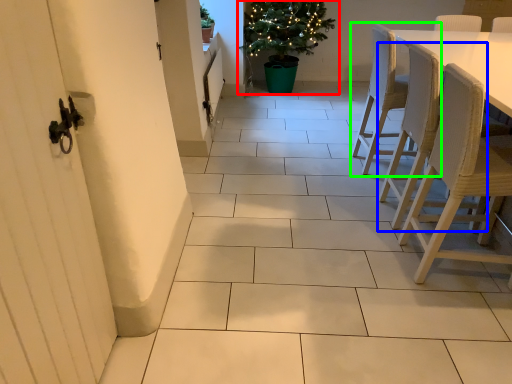
Question: Which object is the farthest from houseplant (highlighted by a red box)? Choose among these: chair (highlighted by a blue box) or chair (highlighted by a green box).

Choices:
 (A) chair
 (B) chair

Answer: (A)